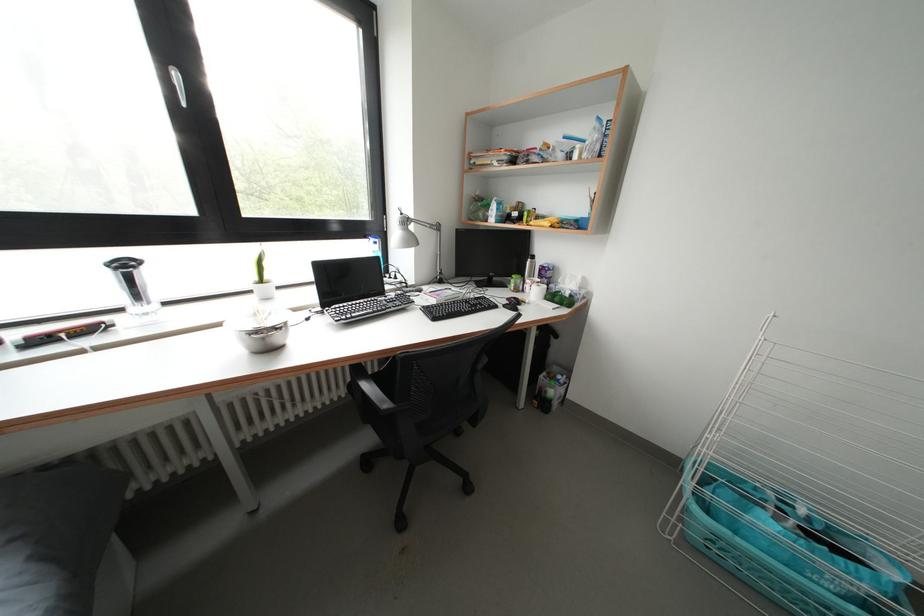
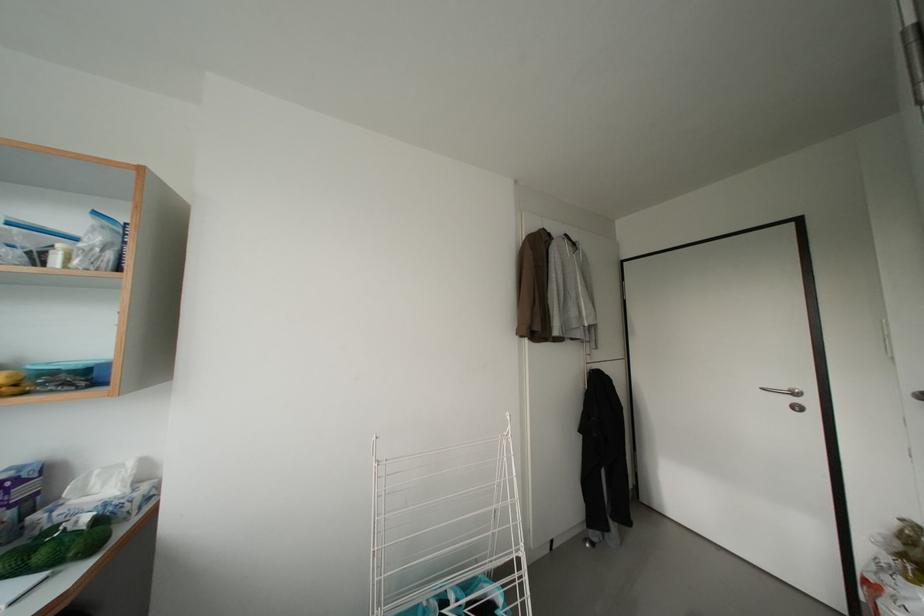
Question: How did the camera likely rotate?

Choices:
 (A) Left
 (B) Right
 (C) Up
 (D) Down

Answer: (B)